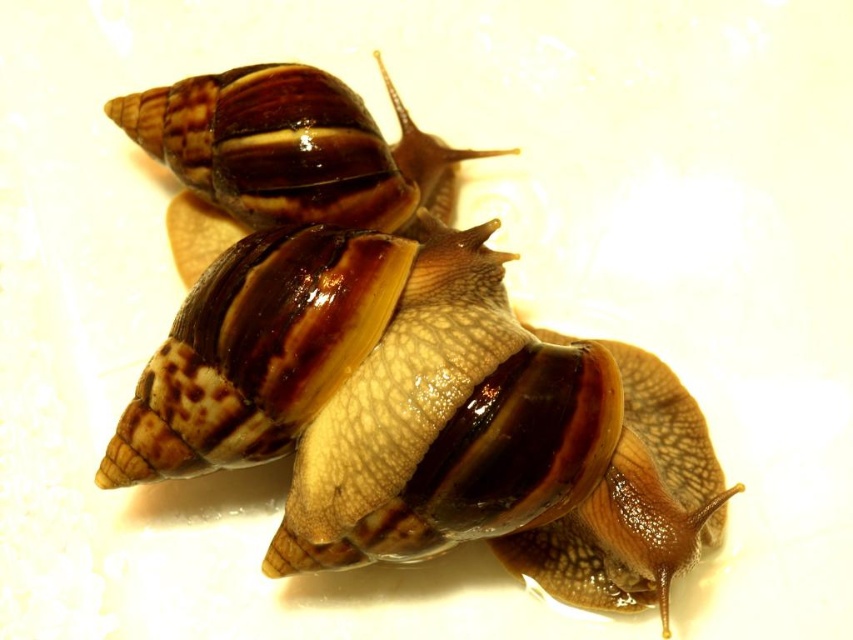
Question: Does brown shiny shell at center have a greater width compared to shiny brown shell at upper center?

Choices:
 (A) no
 (B) yes

Answer: (B)

Question: Which of the following is the farthest from the observer?

Choices:
 (A) brown shiny shell at center
 (B) shiny brown shell at upper center

Answer: (B)

Question: Is brown shiny shell at center wider than shiny brown shell at upper center?

Choices:
 (A) no
 (B) yes

Answer: (B)

Question: Which object is farther from the camera taking this photo?

Choices:
 (A) shiny brown shell at upper center
 (B) brown shiny shell at center

Answer: (A)

Question: Can you confirm if brown shiny shell at center is thinner than shiny brown shell at upper center?

Choices:
 (A) no
 (B) yes

Answer: (A)

Question: Which point is farther to the camera?

Choices:
 (A) shiny brown shell at upper center
 (B) brown shiny shell at center

Answer: (A)